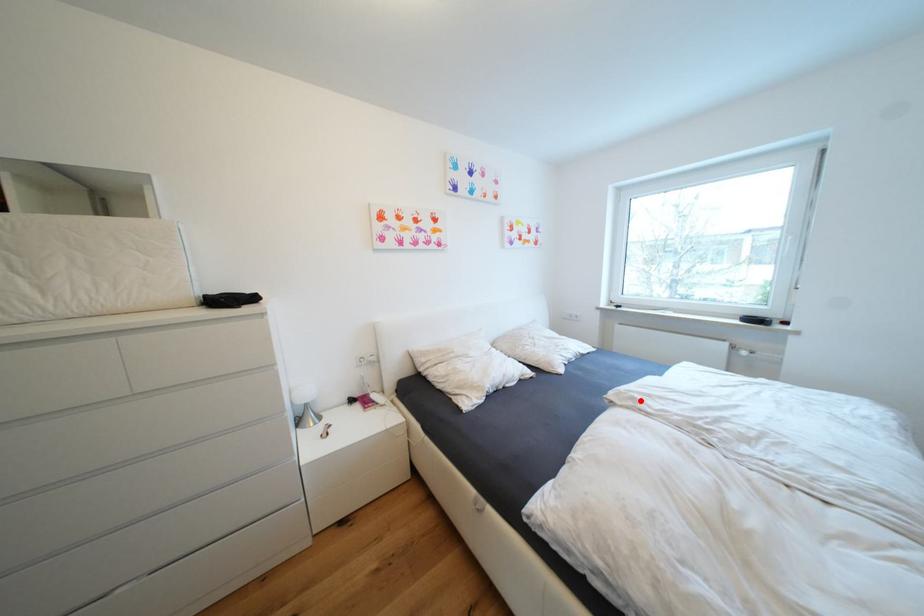
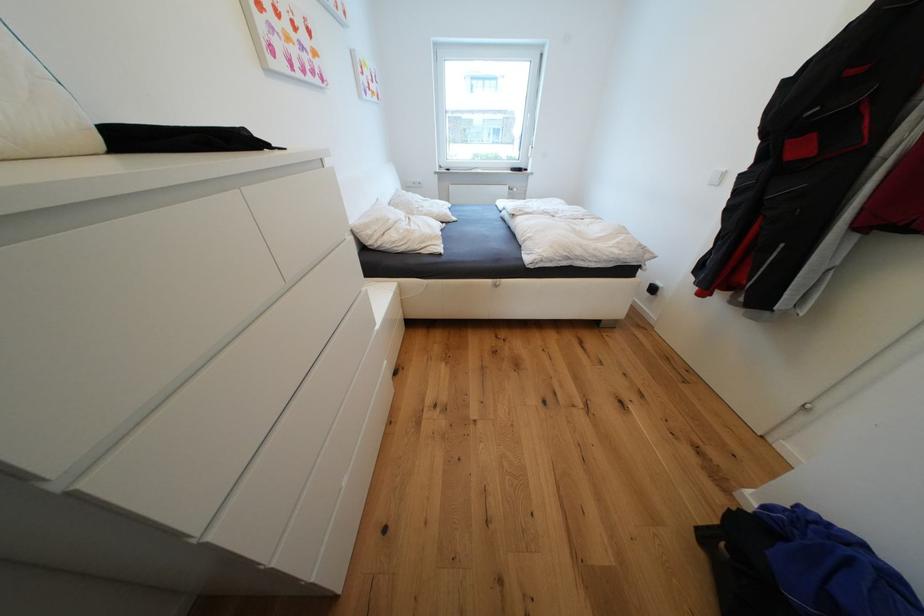
Question: A red point is marked in image1. In image2, is the corresponding 3D point closer to the camera or farther? Reply with the corresponding letter.

Choices:
 (A) The corresponding 3D point is closer.
 (B) The corresponding 3D point is farther.

Answer: (A)